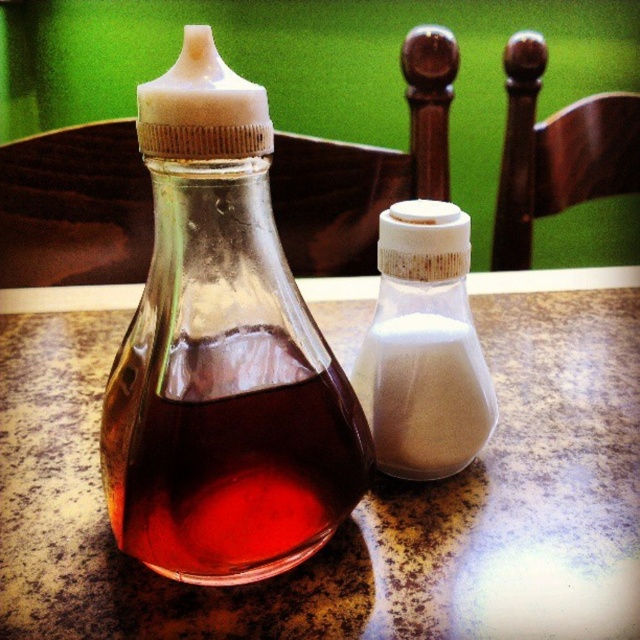
Question: Does transparent glass bottle at center have a larger size compared to translucent glass bottle at center?

Choices:
 (A) yes
 (B) no

Answer: (A)

Question: Which of the following is the farthest from the observer?

Choices:
 (A) (460, 381)
 (B) (156, 545)
 (C) (310, 596)
 (D) (150, 496)

Answer: (A)

Question: Is brown marble table at center positioned before white matte salt shaker at center?

Choices:
 (A) yes
 (B) no

Answer: (A)

Question: Considering the relative positions of translucent glass bottle at center and white matte salt shaker at center in the image provided, where is translucent glass bottle at center located with respect to white matte salt shaker at center?

Choices:
 (A) left
 (B) right

Answer: (A)

Question: Which of the following is the closest to the observer?

Choices:
 (A) white matte salt shaker at center
 (B) transparent glass bottle at center

Answer: (B)

Question: Which object appears closest to the camera in this image?

Choices:
 (A) brown marble table at center
 (B) transparent glass bottle at center

Answer: (B)